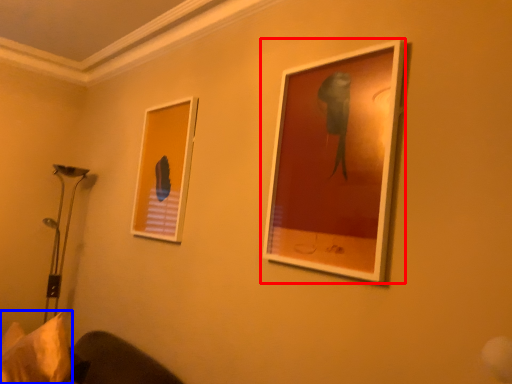
Question: Which object appears farthest to the camera in this image, picture frame (highlighted by a red box) or pillow (highlighted by a blue box)?

Choices:
 (A) picture frame
 (B) pillow

Answer: (B)